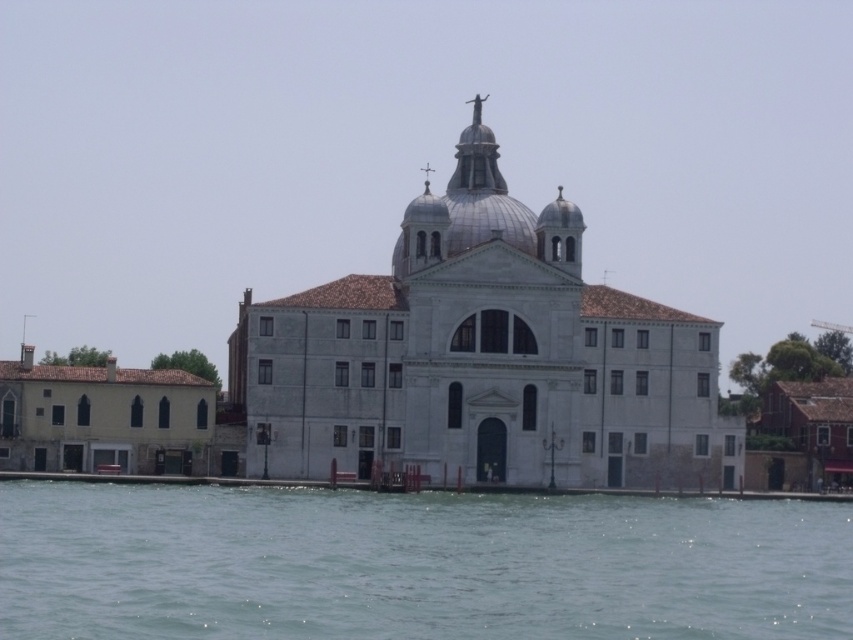
Question: Which object is closer to the camera taking this photo?

Choices:
 (A) yellow matte building at left
 (B) clear water at lower center
 (C) white stone church at center

Answer: (B)

Question: Considering the relative positions of clear water at lower center and yellow matte building at left in the image provided, where is clear water at lower center located with respect to yellow matte building at left?

Choices:
 (A) above
 (B) below

Answer: (B)

Question: Based on their relative distances, which object is farther from the yellow matte building at left?

Choices:
 (A) white stone church at center
 (B) clear water at lower center

Answer: (B)

Question: Can you confirm if clear water at lower center is thinner than yellow matte building at left?

Choices:
 (A) no
 (B) yes

Answer: (A)

Question: Among these objects, which one is nearest to the camera?

Choices:
 (A) yellow matte building at left
 (B) clear water at lower center

Answer: (B)

Question: Is clear water at lower center thinner than white stone church at center?

Choices:
 (A) no
 (B) yes

Answer: (A)